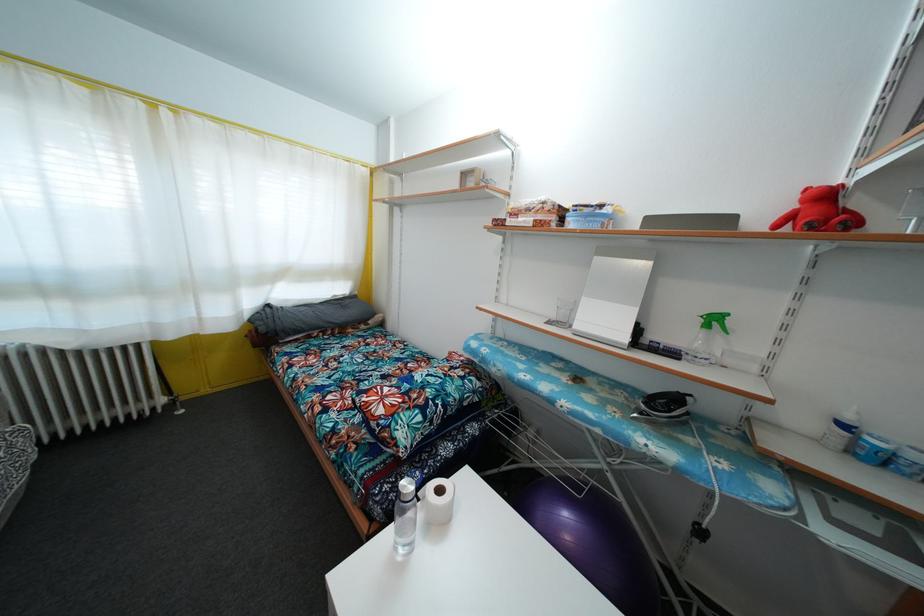
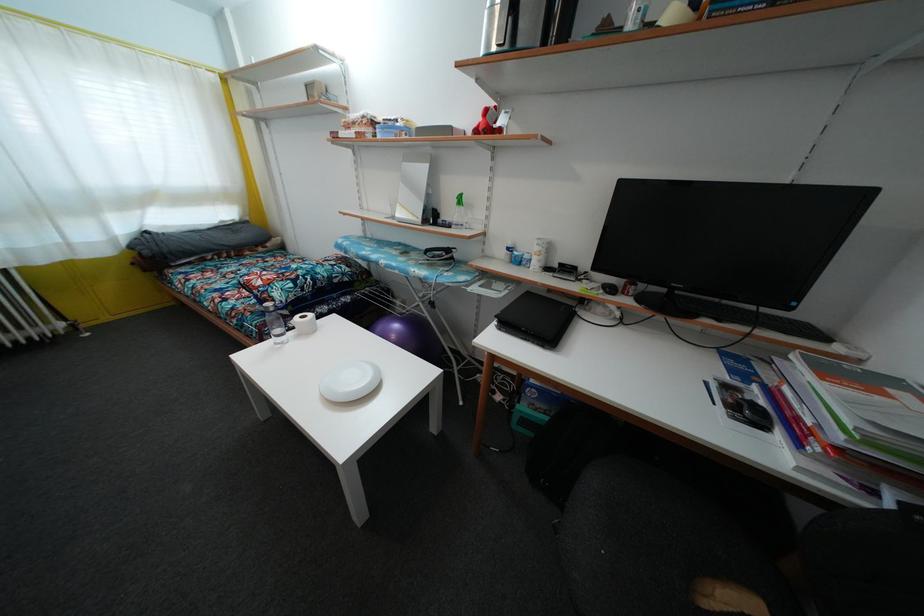
Find the pixel in the second image that matches point (572, 469) in the first image.

(411, 315)